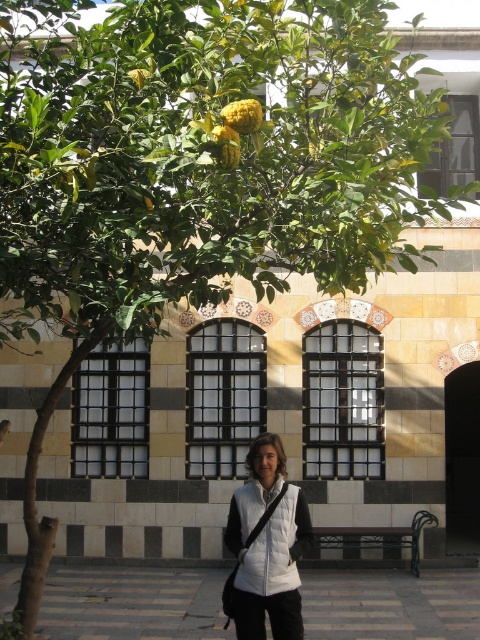
You are a photographer adjusting your camera to focus on two points in the scene. The first point is at coordinates point (187,602) and the second is at point (250,509). Which point is closer to your camera lens?

Point (187,602) is closer to the camera lens because it is further to the viewer than point (250,509).

You are a delivery person trying to walk through the smooth stone pavement at center while carrying a large box that is as wide as your white puffer vest at center. Will the pavement be wide enough for you to pass safely without hitting the edges?

The smooth stone pavement at center has a width larger than the white puffer vest at center, so the pavement is wide enough for you to carry the box safely without hitting the edges.